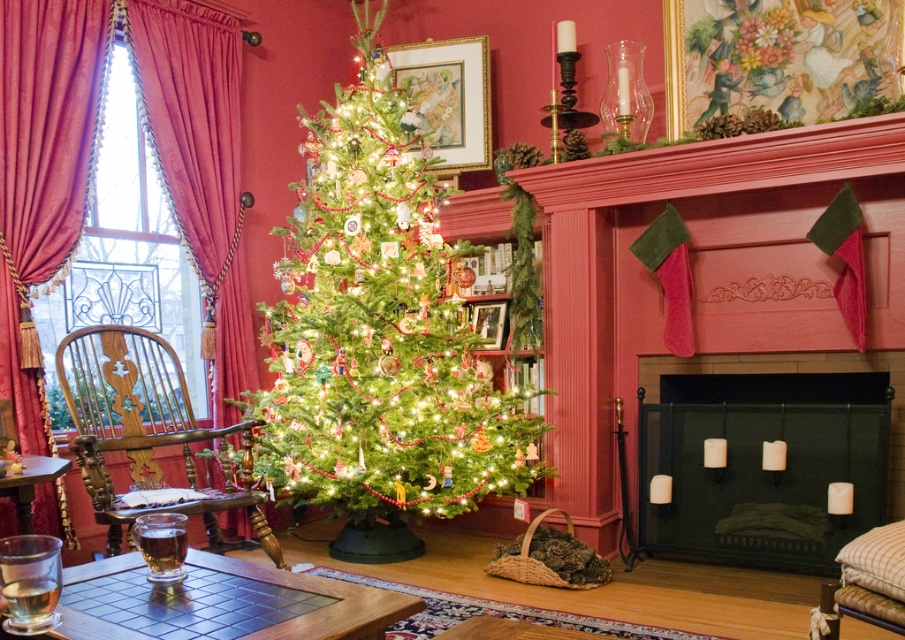
You are sitting in the woodenwoodenarmchair at left and want to reach the black metal fireplace at center to add another log. Can you easily reach it from your current position?

The black metal fireplace at center is positioned on the right side of woodenwoodenarmchair at left, so you can easily reach it by extending your arm to the right side.

You are a delivery person who needs to place a large box that is 3 feet wide in the living room. The box must be placed between the green matte christmas tree at center and the velvet drapery at left. Is there enough space for the box?

The green matte christmas tree at center is 33.04 inches away from the velvet drapery at left. Since 33.04 inches is approximately 2.75 feet, which is less than the 3 feet width of the box, there is not enough space to place the box between them.